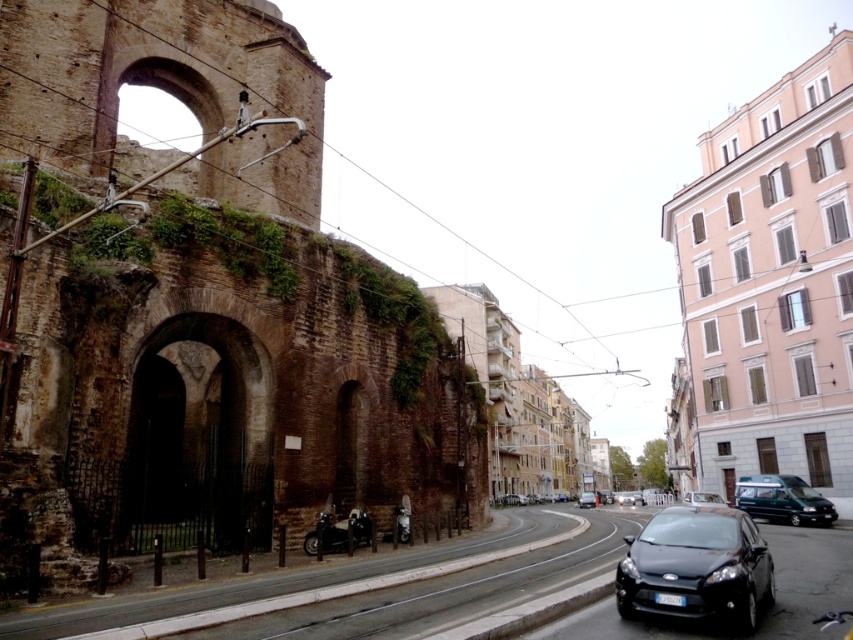
Question: Among these points, which one is farthest from the camera?

Choices:
 (A) (587, 504)
 (B) (671, 518)

Answer: (A)

Question: Is dark brown stone archway at left positioned behind shiny black motorcycle at lower center?

Choices:
 (A) no
 (B) yes

Answer: (A)

Question: Based on their relative distances, which object is farther from the shiny black car at lower right?

Choices:
 (A) shiny black motorcycle at lower center
 (B) white glossy van at center
 (C) shiny black sedan at center

Answer: (C)

Question: Can you confirm if dark brown stone archway at left is wider than shiny black motorcycle at lower center?

Choices:
 (A) yes
 (B) no

Answer: (A)

Question: Is dark brown stone archway at left below shiny black car at lower right?

Choices:
 (A) no
 (B) yes

Answer: (A)

Question: Which object is farther from the camera taking this photo?

Choices:
 (A) shiny black motorcycle at lower center
 (B) white glossy van at center
 (C) shiny chrome motorcycle at center
 (D) shiny black car at lower right

Answer: (B)